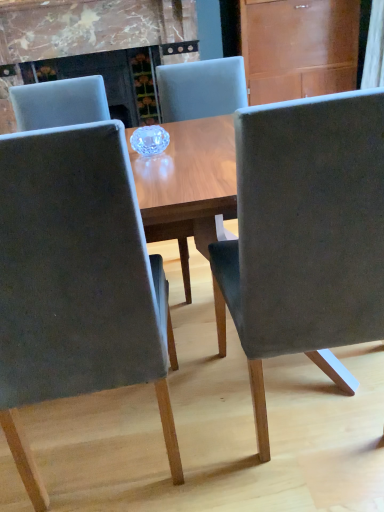
Find the location of a particular element. This screenshot has width=384, height=512. free area in between suede-like gray chair at center, marked as the third chair in a left-to-right arrangement, and velvet gray chair at center, the first chair from the left is located at coordinates (210, 426).